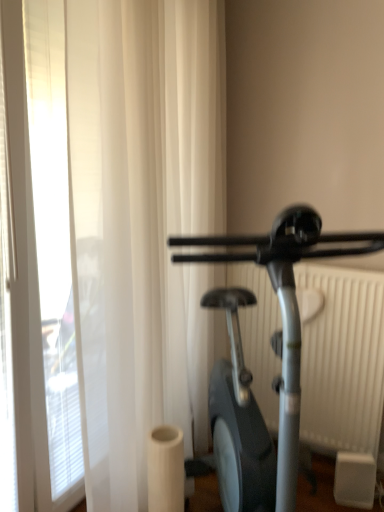
Identify the location of silver metallic stationary bicycle at right. (285, 307).

What is the approximate height of white sheer curtain at left?

It is 2.26 meters.

The width and height of the screenshot is (384, 512). What are the coordinates of `silver metallic stationary bicycle at right` in the screenshot? It's located at (285, 307).

Does silver metallic stationary bicycle at right appear on the right side of white plastic radiator at right?

No.

Is silver metallic stationary bicycle at right oriented away from white plastic radiator at right?

silver metallic stationary bicycle at right is not turned away from white plastic radiator at right.

Between silver metallic stationary bicycle at right and white plastic radiator at right, which one is positioned in front?

silver metallic stationary bicycle at right is closer to the camera.

Based on the photo, from a real-world perspective, which object stands above the other?

In real-world perspective, white sheer curtain at left is above.

Does silver metallic stationary bicycle at right have a larger size compared to white sheer curtain at left?

Yes.

Is silver metallic stationary bicycle at right positioned with its back to white sheer curtain at left?

That's right, silver metallic stationary bicycle at right is facing away from white sheer curtain at left.

Would you consider silver metallic stationary bicycle at right to be distant from white sheer curtain at left?

No, silver metallic stationary bicycle at right is in close proximity to white sheer curtain at left.

Which of these two, white plastic radiator at right or white sheer curtain at left, stands taller?

white sheer curtain at left.

Does white plastic radiator at right have a lesser width compared to white sheer curtain at left?

Indeed, white plastic radiator at right has a lesser width compared to white sheer curtain at left.

Can you confirm if white plastic radiator at right is smaller than white sheer curtain at left?

Yes, white plastic radiator at right is smaller than white sheer curtain at left.

From a real-world perspective, between white plastic radiator at right and silver metallic stationary bicycle at right, who is vertically higher?

silver metallic stationary bicycle at right, from a real-world perspective.

Considering the relative positions of white plastic radiator at right and silver metallic stationary bicycle at right in the image provided, is white plastic radiator at right to the left of silver metallic stationary bicycle at right from the viewer's perspective?

Incorrect, white plastic radiator at right is not on the left side of silver metallic stationary bicycle at right.

Is white plastic radiator at right touching silver metallic stationary bicycle at right?

No, white plastic radiator at right is not beside silver metallic stationary bicycle at right.

Considering the positions of objects white plastic radiator at right and silver metallic stationary bicycle at right in the image provided, who is in front, white plastic radiator at right or silver metallic stationary bicycle at right?

Positioned in front is silver metallic stationary bicycle at right.

Does white sheer curtain at left turn towards white plastic radiator at right?

Yes, white sheer curtain at left is facing white plastic radiator at right.

I want to click on shower curtain in front of the white plastic radiator at right, so click(x=124, y=226).

Which object is more forward, white sheer curtain at left or white plastic radiator at right?

white sheer curtain at left is in front.

Is white sheer curtain at left inside the boundaries of white plastic radiator at right, or outside?

white sheer curtain at left is located beyond the bounds of white plastic radiator at right.

Looking at their sizes, would you say white sheer curtain at left is wider or thinner than silver metallic stationary bicycle at right?

In the image, white sheer curtain at left appears to be more narrow than silver metallic stationary bicycle at right.

Considering the relative positions of white sheer curtain at left and silver metallic stationary bicycle at right in the image provided, is white sheer curtain at left in front of silver metallic stationary bicycle at right?

No.

Is white sheer curtain at left far from silver metallic stationary bicycle at right?

They are positioned close to each other.

Locate an element on the screen. The height and width of the screenshot is (512, 384). stationary bicycle below the white sheer curtain at left (from a real-world perspective) is located at coordinates (285, 307).

Where is `stationary bicycle above the white plastic radiator at right (from the image's perspective)`? This screenshot has width=384, height=512. stationary bicycle above the white plastic radiator at right (from the image's perspective) is located at coordinates (285, 307).

Where is `shower curtain on the left side of silver metallic stationary bicycle at right`? shower curtain on the left side of silver metallic stationary bicycle at right is located at coordinates (124, 226).

Estimate the real-world distances between objects in this image. Which object is closer to white sheer curtain at left, silver metallic stationary bicycle at right or white plastic radiator at right?

The object closer to white sheer curtain at left is white plastic radiator at right.

Based on their spatial positions, is white plastic radiator at right or white sheer curtain at left further from silver metallic stationary bicycle at right?

white plastic radiator at right is further to silver metallic stationary bicycle at right.

Looking at the image, which one is located closer to white plastic radiator at right, silver metallic stationary bicycle at right or white sheer curtain at left?

white sheer curtain at left lies closer to white plastic radiator at right than the other object.

From the image, which object appears to be nearer to white sheer curtain at left, white plastic radiator at right or silver metallic stationary bicycle at right?

white plastic radiator at right.

In the scene shown: From the image, which object appears to be farther from silver metallic stationary bicycle at right, white sheer curtain at left or white plastic radiator at right?

Among the two, white plastic radiator at right is located further to silver metallic stationary bicycle at right.

Looking at the image, which one is located closer to white plastic radiator at right, white sheer curtain at left or silver metallic stationary bicycle at right?

→ white sheer curtain at left is positioned closer to the anchor white plastic radiator at right.

Locate an element on the screen. The image size is (384, 512). shower curtain located between silver metallic stationary bicycle at right and white plastic radiator at right in the depth direction is located at coordinates (124, 226).